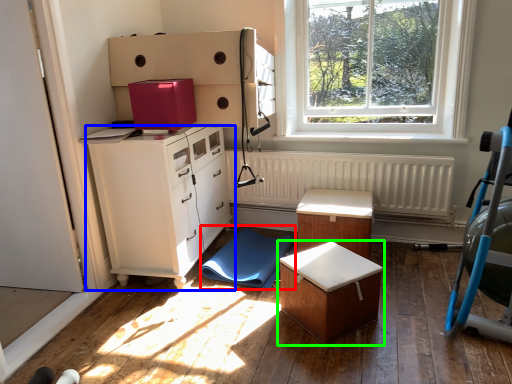
Question: Considering the real-world distances, which object is farthest from swivel chair (highlighted by a red box)? chest of drawers (highlighted by a blue box) or table (highlighted by a green box)?

Choices:
 (A) chest of drawers
 (B) table

Answer: (B)